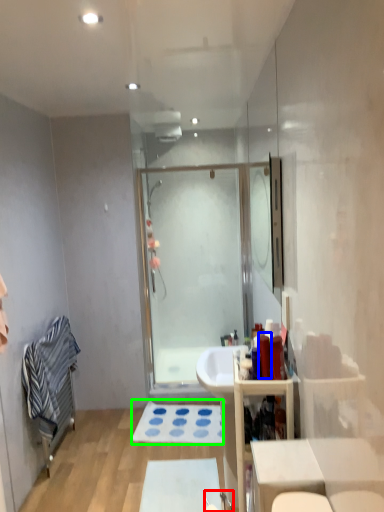
Question: Estimate the real-world distances between objects in this image. Which object is farther from faucet (highlighted by a red box), toiletry (highlighted by a blue box) or bath mat (highlighted by a green box)?

Choices:
 (A) toiletry
 (B) bath mat

Answer: (A)